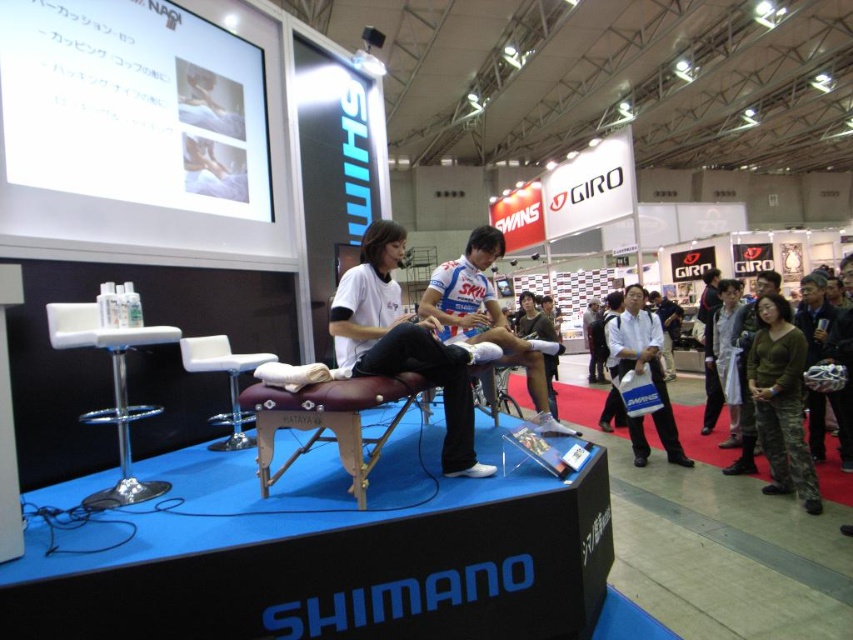
You are at a cycling exhibition and see the white fabric cycling jersey at center and the white leather stool at center. Which item is positioned to the right of the other?

The white fabric cycling jersey at center is to the right of the white leather stool at center.

You are organizing a small event at the trade show and need to seat two people comfortably. You have a brown leather stool at center and a white leather stool at center available. Which stool provides more seating space for a person?

The brown leather stool at center has a greater width than the white leather stool at center, so it provides more seating space.

You are a photographer at the event and need to position a light stand between the white fabric cycling jersey at center and the white leather stool at center. The light stand requires a minimum of 1 meter of space between the two objects to be placed safely. Can you fit the light stand in this space?

The distance between the white fabric cycling jersey at center and the white leather stool at center is 1.22 meters, which is greater than the required 1 meter. Therefore, the light stand can be safely placed in the space between them.